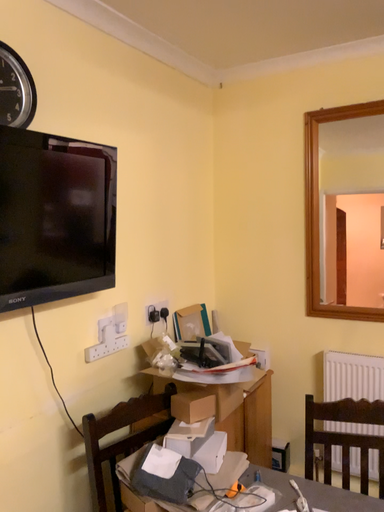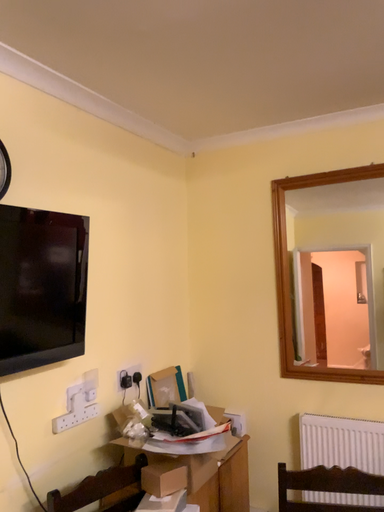
Question: How did the camera likely rotate when shooting the video?

Choices:
 (A) rotated downward
 (B) rotated upward

Answer: (B)